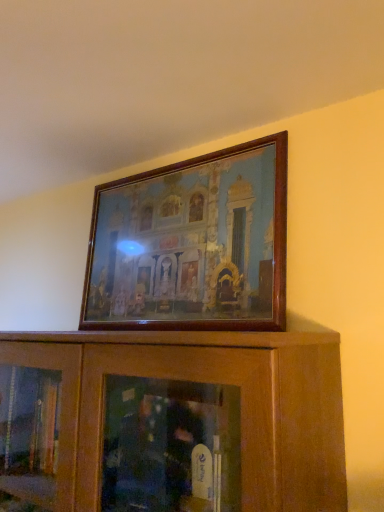
Locate an element on the screen. blank space above wooden picture frame at upper center (from a real-world perspective) is located at coordinates (178, 161).